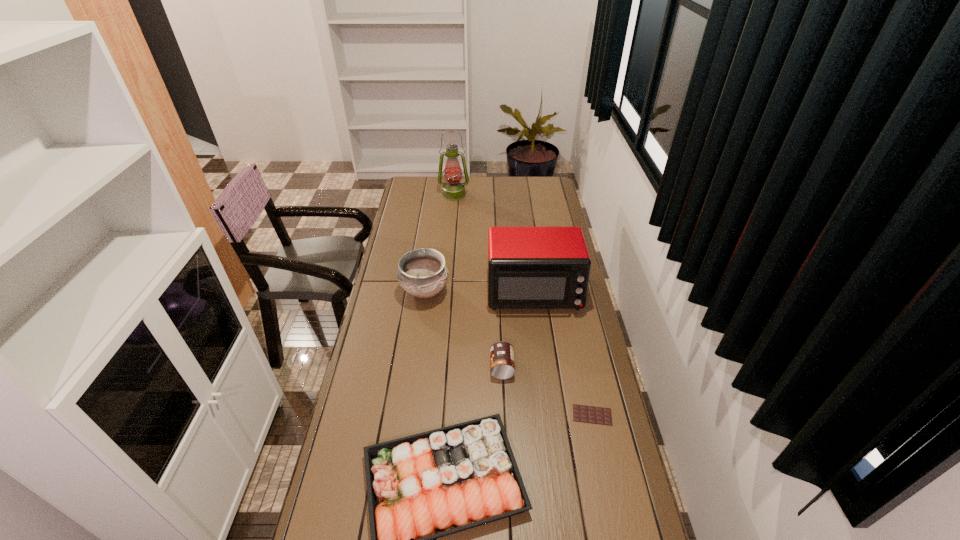
Locate an element on the screen. The height and width of the screenshot is (540, 960). vacant space at the right edge of the desktop is located at coordinates (564, 370).

The image size is (960, 540). In the image, there is a desktop. In order to click on free space at the far right corner in this screenshot , I will do `click(529, 182)`.

I want to click on free space between the chocolate bar and the fifth shortest object, so (x=563, y=353).

Where is `empty space between the can and the farthest object`? Image resolution: width=960 pixels, height=540 pixels. empty space between the can and the farthest object is located at coordinates (478, 281).

Where is `free spot between the toaster oven and the third nearest object`? This screenshot has height=540, width=960. free spot between the toaster oven and the third nearest object is located at coordinates (517, 329).

At what (x,y) coordinates should I click in order to perform the action: click on free point between the second tallest object and the can. Please return your answer as a coordinate pair (x, y). This screenshot has height=540, width=960. Looking at the image, I should click on click(517, 329).

Find the location of a particular element. The width and height of the screenshot is (960, 540). unoccupied area between the oil lamp and the can is located at coordinates (478, 281).

Find the location of a particular element. vacant point located between the oil lamp and the fourth shortest object is located at coordinates coord(440,244).

The image size is (960, 540). I want to click on empty space between the toaster oven and the third nearest object, so click(x=517, y=329).

Locate an element on the screen. The image size is (960, 540). the second closest object relative to the third nearest object is located at coordinates (x=528, y=267).